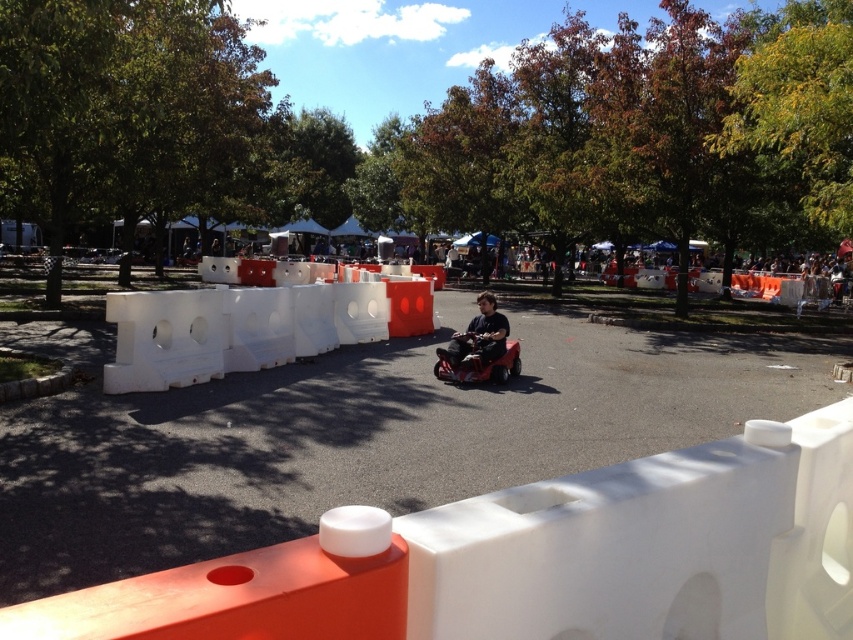
You are standing at the edge of the park and want to take a photo of the dark gray fabric jacket at center without the white plastic barrier at center blocking the view. Is the barrier in front of the jacket or behind it?

The white plastic barrier at center is closer to the viewer than the dark gray fabric jacket at center, so the barrier is in front of the jacket and would block the view.

You are standing at the point with coordinates point [247,326] in the image. What object are you standing on?

The point [247,326] corresponds to the white plastic barrier at center.